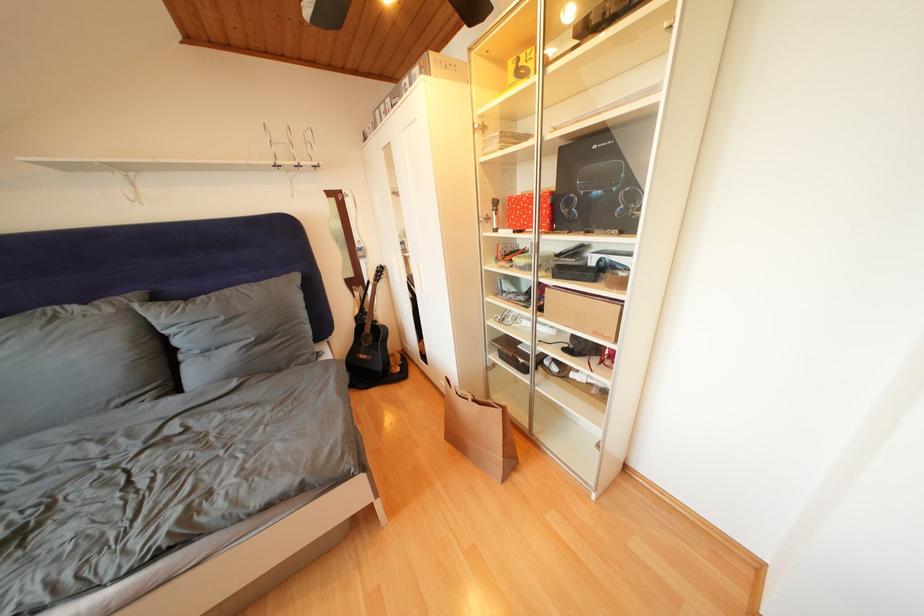
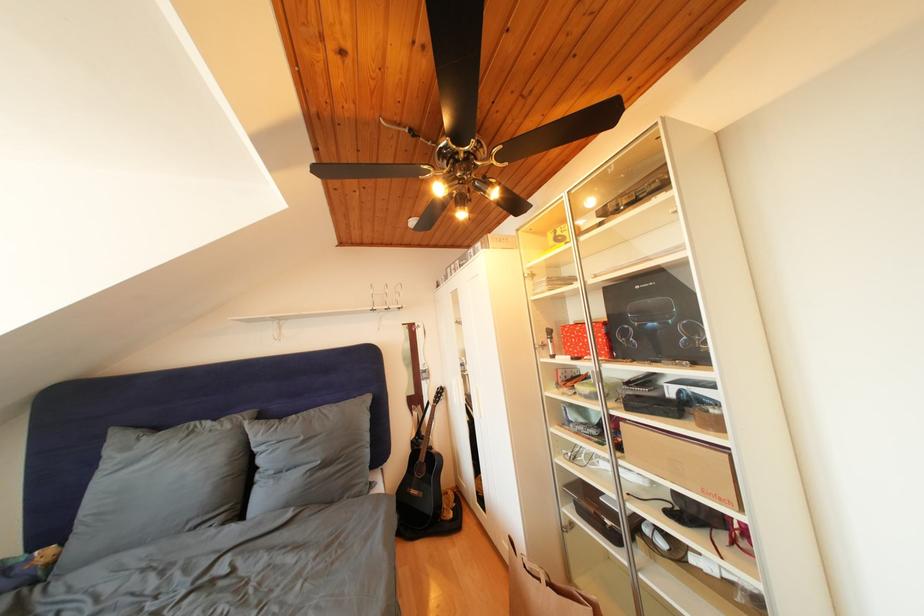
Where in the second image is the point corresponding to (x=512, y=408) from the first image?

(602, 602)